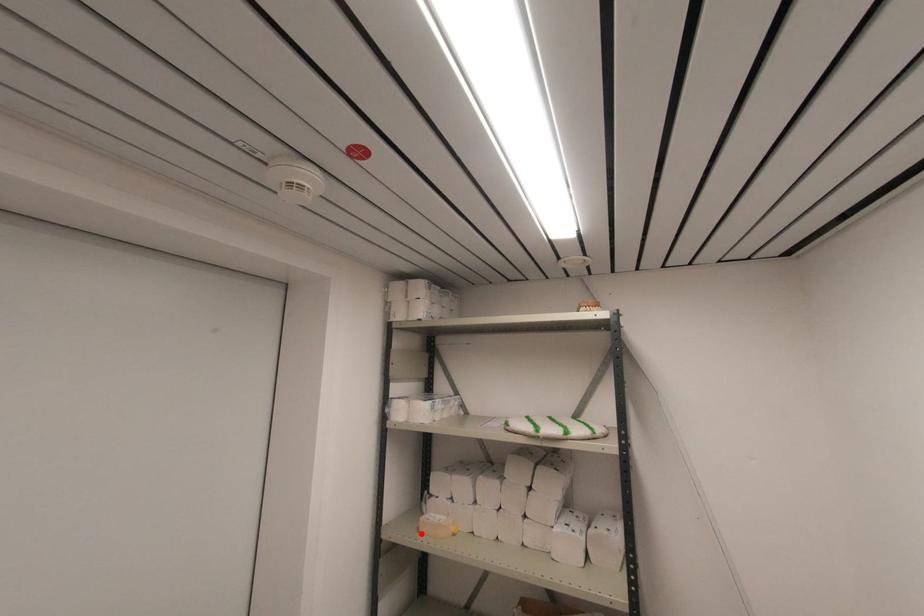
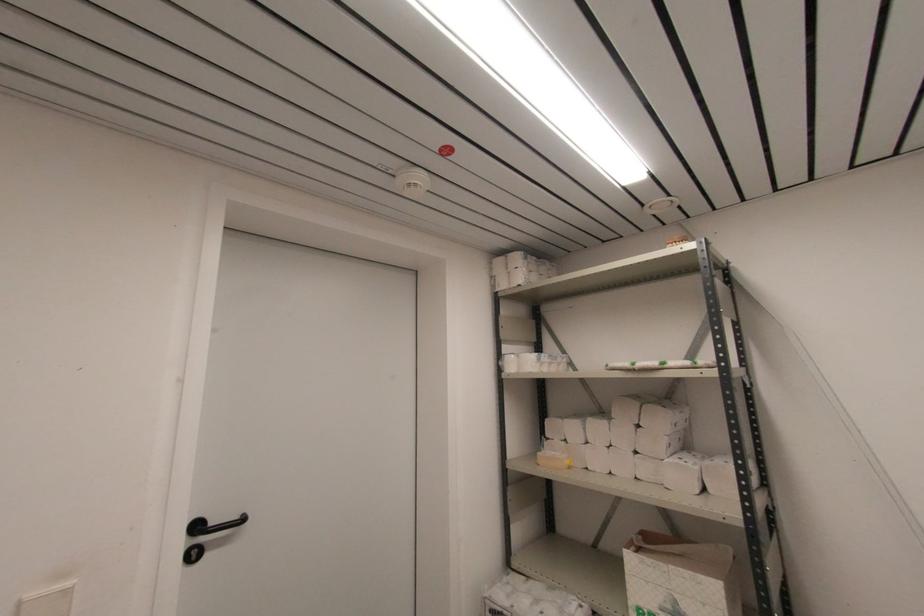
In the second image, find the point that corresponds to the highlighted location in the first image.

(540, 464)